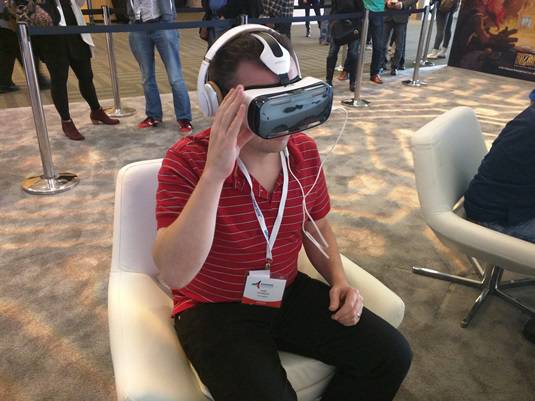
Locate an element on the screen. carpet is located at coordinates (366, 164).